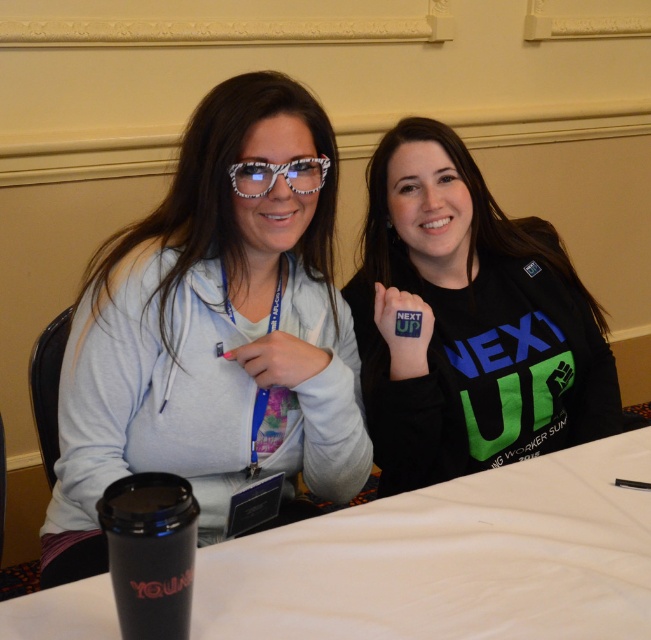
Which of these two, white matte table at center or translucent zebra-patterned glasses at center, stands shorter?

With less height is translucent zebra-patterned glasses at center.

Which is in front, point (64, 589) or point (305, 189)?

Positioned in front is point (64, 589).

Find the location of a particular element. This screenshot has width=651, height=640. white matte table at center is located at coordinates (452, 557).

Does white matte table at center have a greater width compared to black matte shirt at center?

Indeed, white matte table at center has a greater width compared to black matte shirt at center.

Does white matte table at center have a lesser height compared to black matte shirt at center?

Yes.

Is point (327, 566) in front of point (568, 378)?

Yes, it is.

Where is `white matte table at center`? The width and height of the screenshot is (651, 640). white matte table at center is located at coordinates (452, 557).

Does point (340, 440) lie behind point (266, 164)?

Yes, point (340, 440) is farther from viewer.

Can you confirm if matte gray hoodie at center is thinner than translucent zebra-patterned glasses at center?

No, matte gray hoodie at center is not thinner than translucent zebra-patterned glasses at center.

You are a GUI agent. You are given a task and a screenshot of the screen. Output one action in this format:
    pyautogui.click(x=<x>, y=<y>)
    Task: Click on the matte gray hoodie at center
    Image resolution: width=651 pixels, height=640 pixels.
    Given the screenshot: What is the action you would take?
    pyautogui.click(x=212, y=333)